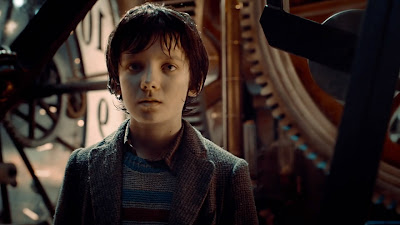
At what (x,y) coordinates should I click in order to perform the action: click on numbers on clock face. Please return your answer as a coordinate pair (x, y). This screenshot has width=400, height=225. Looking at the image, I should click on (96, 35), (105, 119).